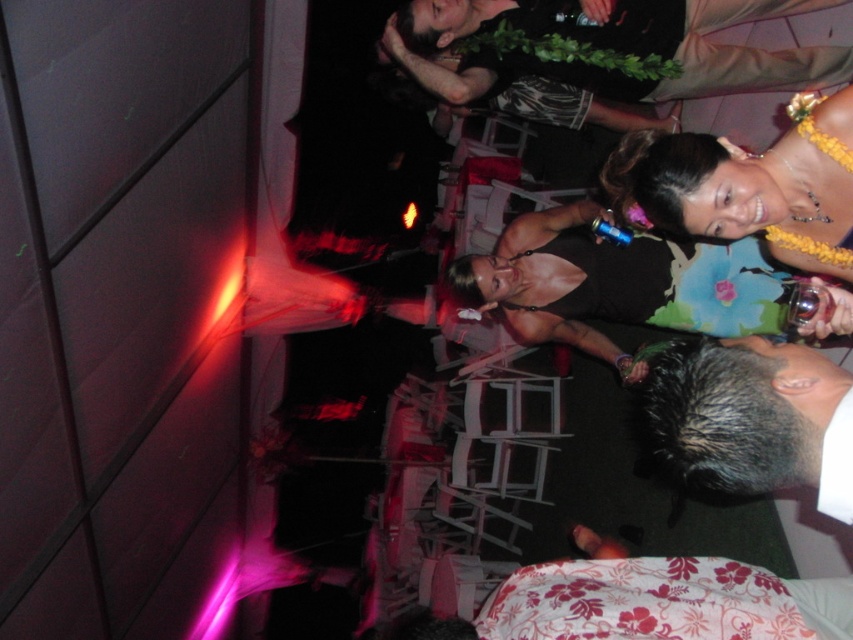
Question: In this image, where is light brown leather jacket at upper center located relative to gray hair at lower right?

Choices:
 (A) left
 (B) right

Answer: (B)

Question: Which of these objects is positioned farthest from the gray hair at lower right?

Choices:
 (A) floral fabric lei at upper right
 (B) light brown leather jacket at upper center
 (C) floral fabric dress at center

Answer: (B)

Question: Does light brown leather jacket at upper center come in front of gray hair at lower right?

Choices:
 (A) yes
 (B) no

Answer: (B)

Question: Which point is farther from the camera taking this photo?

Choices:
 (A) (679, 248)
 (B) (662, 426)
 (C) (485, 77)
 (D) (624, 141)

Answer: (C)

Question: In this image, where is light brown leather jacket at upper center located relative to gray hair at lower right?

Choices:
 (A) left
 (B) right

Answer: (B)

Question: Among these points, which one is nearest to the camera?

Choices:
 (A) (x=583, y=1)
 (B) (x=590, y=234)

Answer: (A)